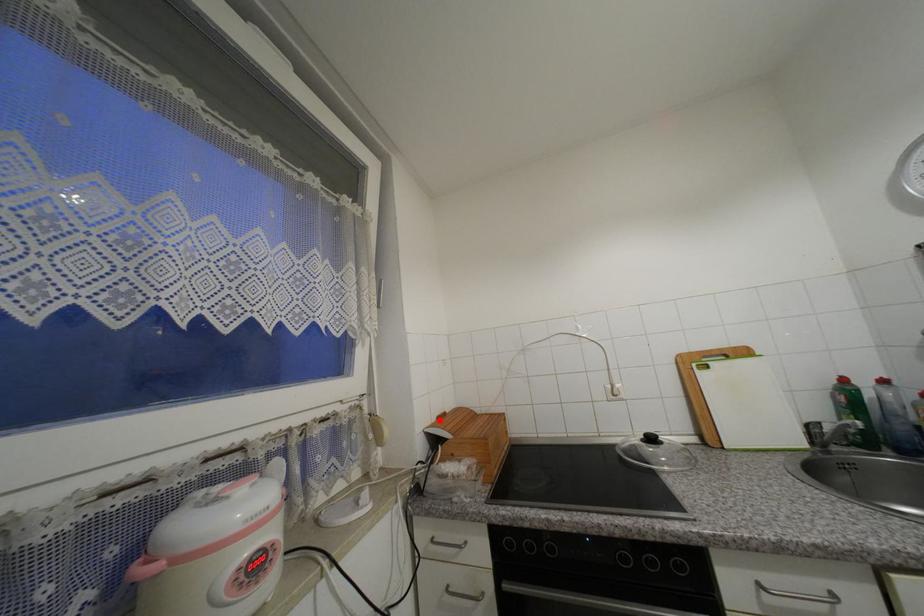
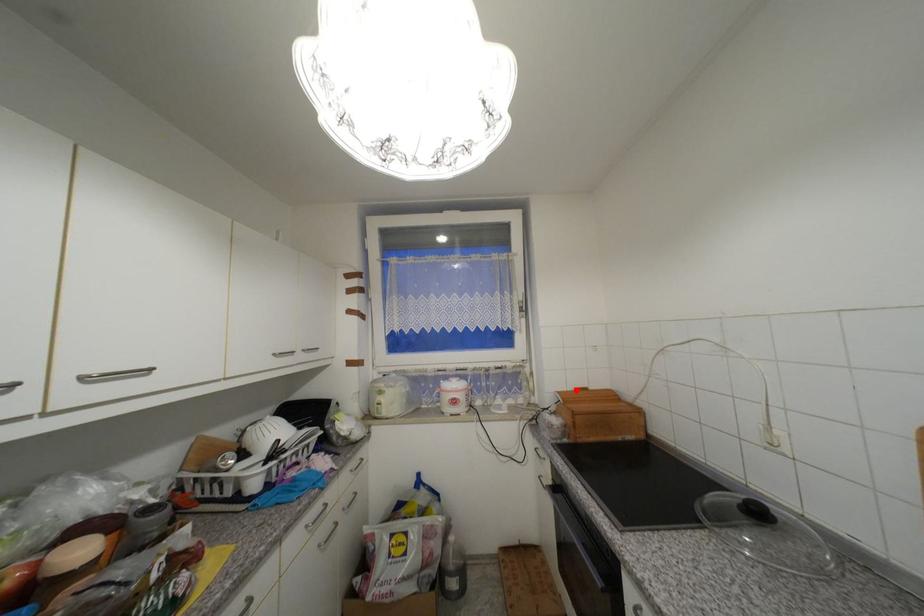
I am providing you with two images of the same scene from different viewpoints. A red point is marked on the first image and another point is marked on the second image. Is the red point in image1 aligned with the point shown in image2?

Yes